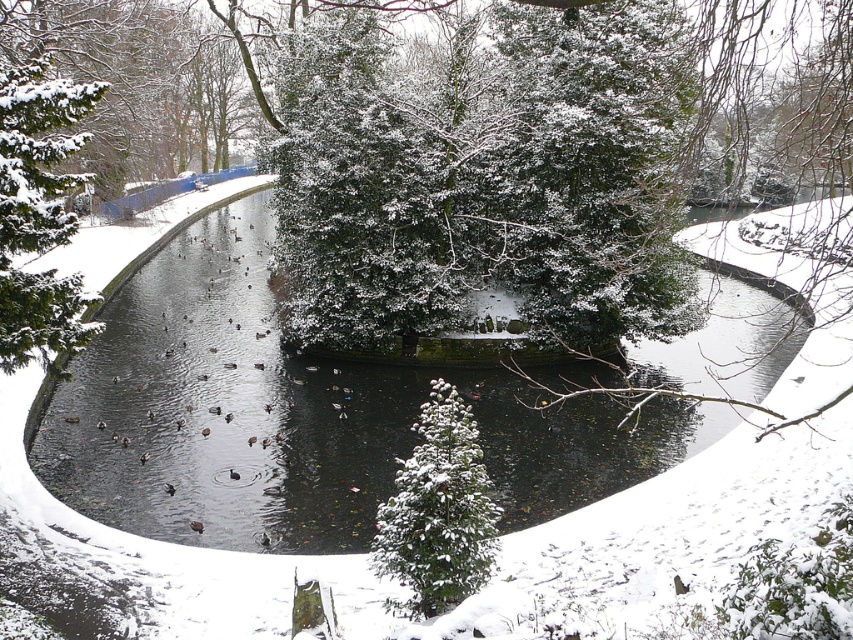
Question: Is green matte tree at left to the left of snow-covered evergreen tree at center from the viewer's perspective?

Choices:
 (A) no
 (B) yes

Answer: (B)

Question: From the image, what is the correct spatial relationship of green matte tree at left in relation to snow-covered evergreen tree at center?

Choices:
 (A) below
 (B) above

Answer: (B)

Question: Estimate the real-world distances between objects in this image. Which object is closer to the snow-covered evergreen tree at center?

Choices:
 (A) black water at center
 (B) green matte tree at left

Answer: (B)

Question: Estimate the real-world distances between objects in this image. Which object is closer to the snow-covered evergreen tree at center?

Choices:
 (A) green matte tree at left
 (B) black water at center

Answer: (A)

Question: Among these objects, which one is farthest from the camera?

Choices:
 (A) green matte tree at left
 (B) snow-covered evergreen tree at center

Answer: (A)

Question: Does black water at center appear over snow-covered evergreen tree at center?

Choices:
 (A) yes
 (B) no

Answer: (A)